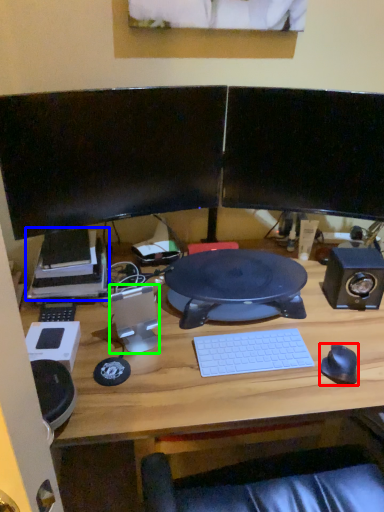
Question: Considering the real-world distances, which object is closest to mouse (highlighted by a red box)? printer (highlighted by a blue box) or speaker (highlighted by a green box).

Choices:
 (A) printer
 (B) speaker

Answer: (B)